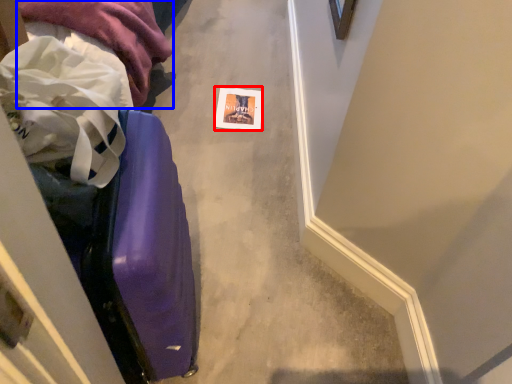
Question: Which object appears farthest to the camera in this image, postcard (highlighted by a red box) or clothing (highlighted by a blue box)?

Choices:
 (A) postcard
 (B) clothing

Answer: (A)